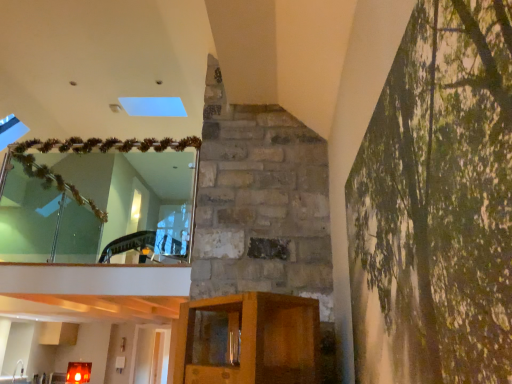
Question: From the image's perspective, would you say clear glass mirror at upper left is shown under green textured canvas at right?

Choices:
 (A) yes
 (B) no

Answer: (B)

Question: Is clear glass mirror at upper left smaller than green textured canvas at right?

Choices:
 (A) no
 (B) yes

Answer: (A)

Question: Does clear glass mirror at upper left contain green textured canvas at right?

Choices:
 (A) no
 (B) yes

Answer: (A)

Question: Is clear glass mirror at upper left thinner than green textured canvas at right?

Choices:
 (A) no
 (B) yes

Answer: (A)

Question: Is clear glass mirror at upper left positioned behind green textured canvas at right?

Choices:
 (A) yes
 (B) no

Answer: (A)

Question: From the image's perspective, relative to green textured canvas at right, is clear glass mirror at upper left above or below?

Choices:
 (A) below
 (B) above

Answer: (B)

Question: From a real-world perspective, relative to green textured canvas at right, is clear glass mirror at upper left vertically above or below?

Choices:
 (A) above
 (B) below

Answer: (A)

Question: Is clear glass mirror at upper left bigger or smaller than green textured canvas at right?

Choices:
 (A) big
 (B) small

Answer: (A)

Question: In terms of width, does clear glass mirror at upper left look wider or thinner when compared to green textured canvas at right?

Choices:
 (A) wide
 (B) thin

Answer: (A)

Question: In the image, is brushed metal sink at lower left positioned in front of or behind green textured canvas at right?

Choices:
 (A) front
 (B) behind

Answer: (B)

Question: Is brushed metal sink at lower left taller or shorter than green textured canvas at right?

Choices:
 (A) tall
 (B) short

Answer: (B)

Question: From a real-world perspective, relative to green textured canvas at right, is brushed metal sink at lower left vertically above or below?

Choices:
 (A) below
 (B) above

Answer: (A)

Question: In terms of width, does brushed metal sink at lower left look wider or thinner when compared to green textured canvas at right?

Choices:
 (A) thin
 (B) wide

Answer: (B)

Question: Based on their sizes in the image, would you say green textured canvas at right is bigger or smaller than brushed metal sink at lower left?

Choices:
 (A) big
 (B) small

Answer: (A)

Question: From the image's perspective, is green textured canvas at right located above or below brushed metal sink at lower left?

Choices:
 (A) below
 (B) above

Answer: (B)